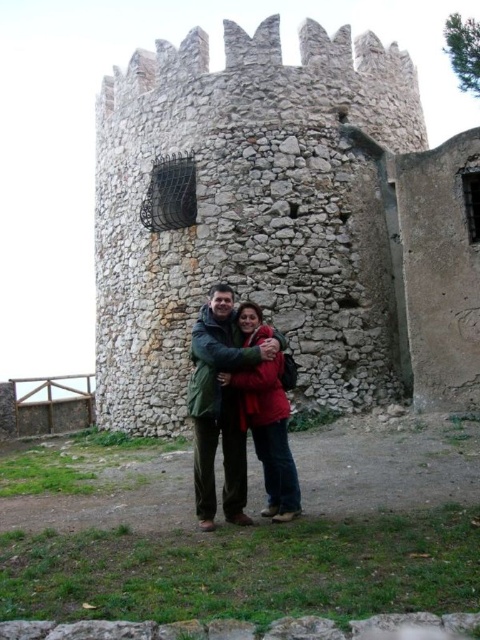
You are a photographer trying to capture the stone wall at center and the green wool coat at center in the same frame. Based on their positions, which object should you focus on first to ensure both are in focus?

The stone wall at center is positioned over the green wool coat at center, so you should focus on the stone wall at center first to ensure both are in focus.

You are a painter who wants to paint the stone wall at center and the green wool coat at center in the image. If you have a limited amount of paint, which object should you prioritize painting first, considering their sizes?

The stone wall at center is much taller than the green wool coat at center, so you should prioritize painting the stone wall at center first as it requires more paint due to its larger size.

You are standing in front of the medieval tower and want to determine which of the two points, point (430, 326) or point (195, 369), is closer to you. Based on the scene, can you tell which one is nearer?

Point (430, 326) is further to the viewer than point (195, 369), so the closer point is point (195, 369).